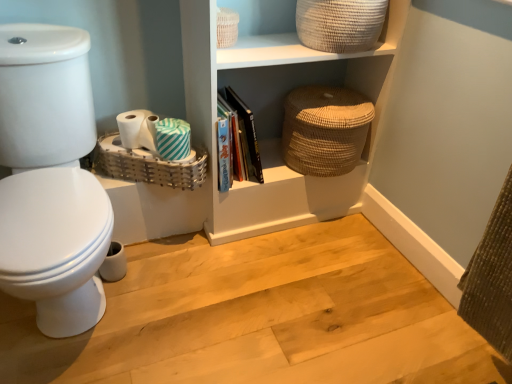
This screenshot has height=384, width=512. Find the location of `vacant area that lies between teal striped toilet paper at center, which is counted as the third toilet paper, starting from the left, and white matte toilet paper at lower left, which ranks as the 1th toilet paper in left-to-right order`. vacant area that lies between teal striped toilet paper at center, which is counted as the third toilet paper, starting from the left, and white matte toilet paper at lower left, which ranks as the 1th toilet paper in left-to-right order is located at coordinates (144, 147).